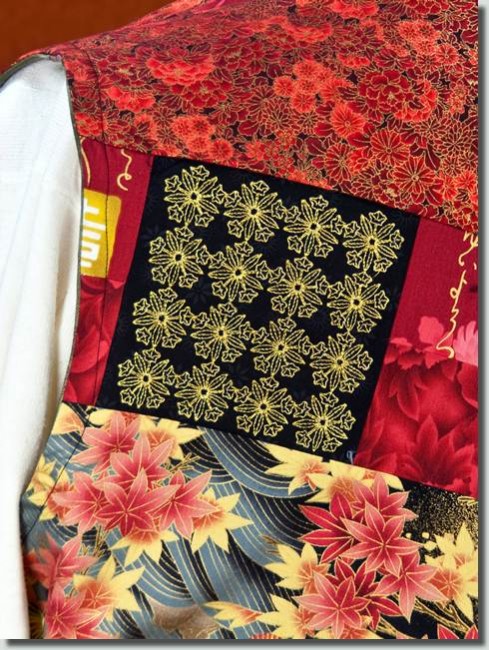
Where is `pillow`? The height and width of the screenshot is (650, 489). pillow is located at coordinates [x=42, y=246].